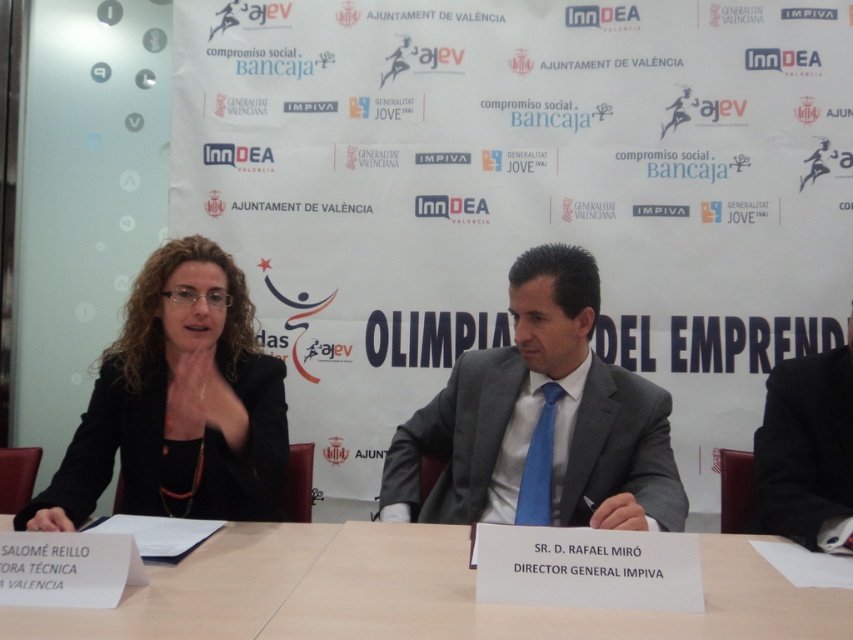
Between white paper at center and blue silk tie at center, which one is positioned lower?

white paper at center is below.

Is white paper at center shorter than blue silk tie at center?

Yes.

Between point (392, 566) and point (548, 481), which one is positioned behind?

The point (548, 481) is behind.

What are the coordinates of `white paper at center` in the screenshot? It's located at (413, 593).

Does white paper at center have a greater width compared to black suit at right?

Yes, white paper at center is wider than black suit at right.

I want to click on white paper at center, so click(x=413, y=593).

Find the location of a particular element. The image size is (853, 640). white paper at center is located at coordinates (413, 593).

Who is lower down, gray suit at center or black matte jacket at center?

gray suit at center is below.

Which is behind, point (584, 484) or point (238, 468)?

Positioned behind is point (584, 484).

Who is more forward, (x=579, y=493) or (x=231, y=490)?

Point (x=579, y=493) is more forward.

Locate an element on the screen. This screenshot has width=853, height=640. gray suit at center is located at coordinates (541, 420).